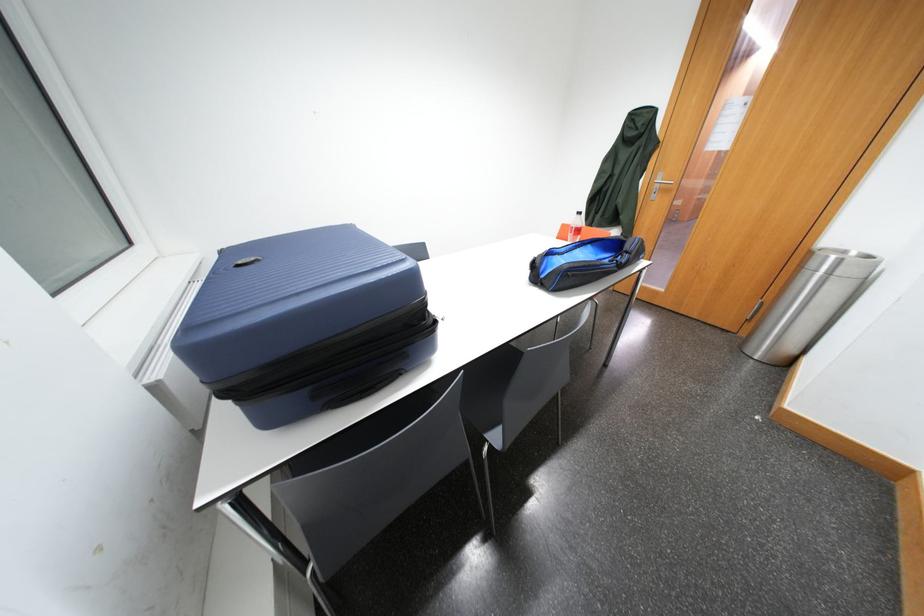
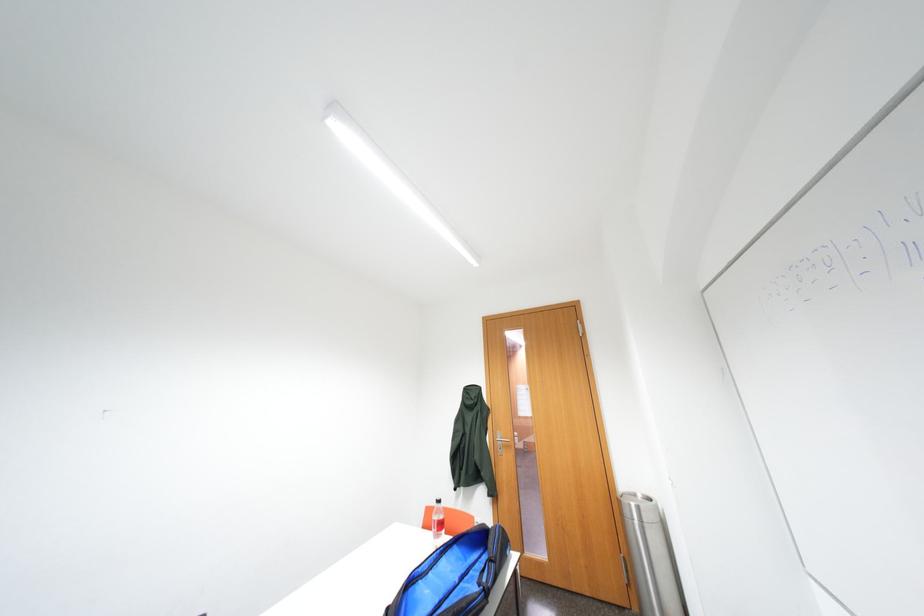
The first image is from the beginning of the video and the second image is from the end. How did the camera likely rotate when shooting the video?

The rotation direction of the camera is right-up.